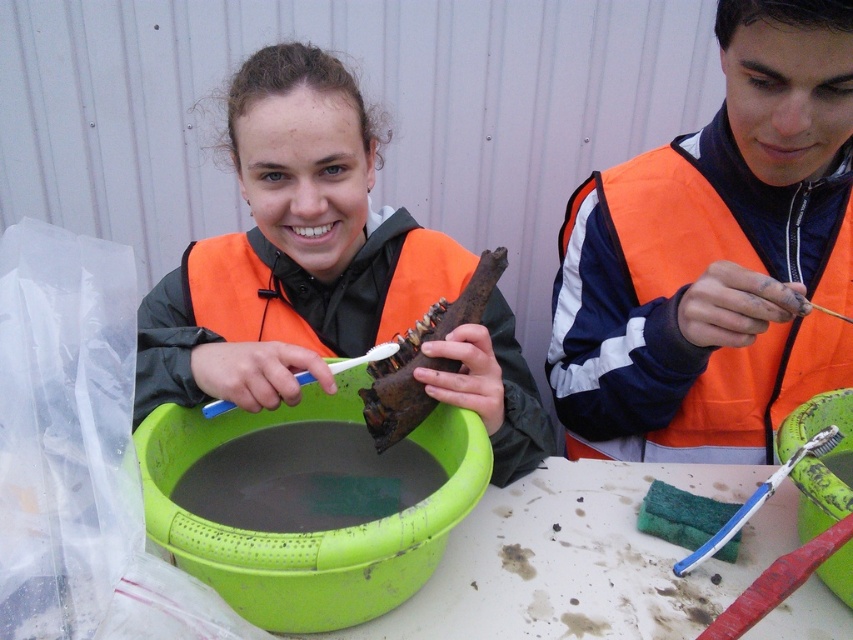
Question: Observing the image, what is the correct spatial positioning of orange reflective vest at center in reference to green plastic bowl at center?

Choices:
 (A) left
 (B) right

Answer: (B)

Question: Based on their relative distances, which object is farther from the rusty metal lobster at center?

Choices:
 (A) green plastic bowl at center
 (B) orange reflective vest at center
 (C) matte orange vest at center

Answer: (B)

Question: Is matte orange vest at center wider than green plastic bowl at center?

Choices:
 (A) yes
 (B) no

Answer: (A)

Question: Which of these objects is positioned farthest from the orange reflective vest at center?

Choices:
 (A) matte orange vest at center
 (B) rusty metal lobster at center

Answer: (B)

Question: Estimate the real-world distances between objects in this image. Which object is closer to the rusty metal lobster at center?

Choices:
 (A) matte orange vest at center
 (B) orange reflective vest at center
 (C) green plastic bowl at center

Answer: (C)

Question: Can you confirm if matte orange vest at center is positioned above green plastic bowl at center?

Choices:
 (A) yes
 (B) no

Answer: (A)